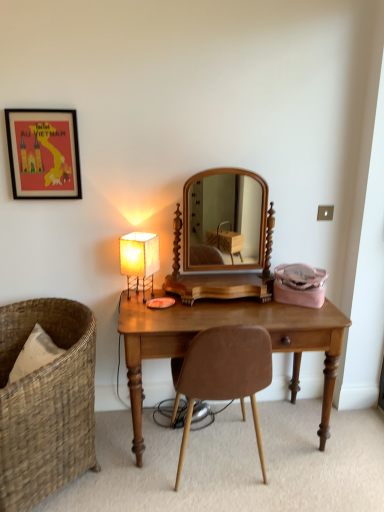
This screenshot has height=512, width=384. I want to click on free space in front of white paper lampshade at left, so click(x=149, y=308).